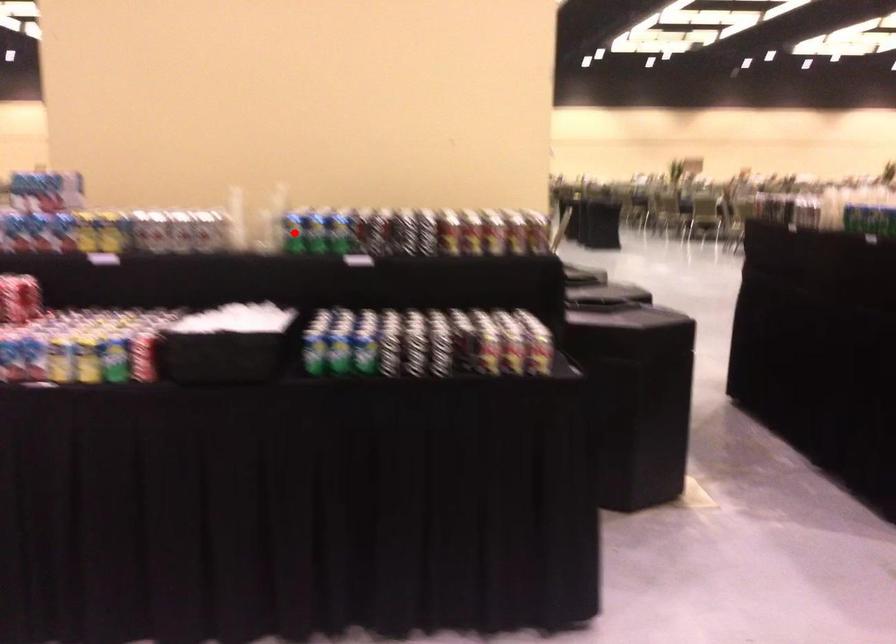
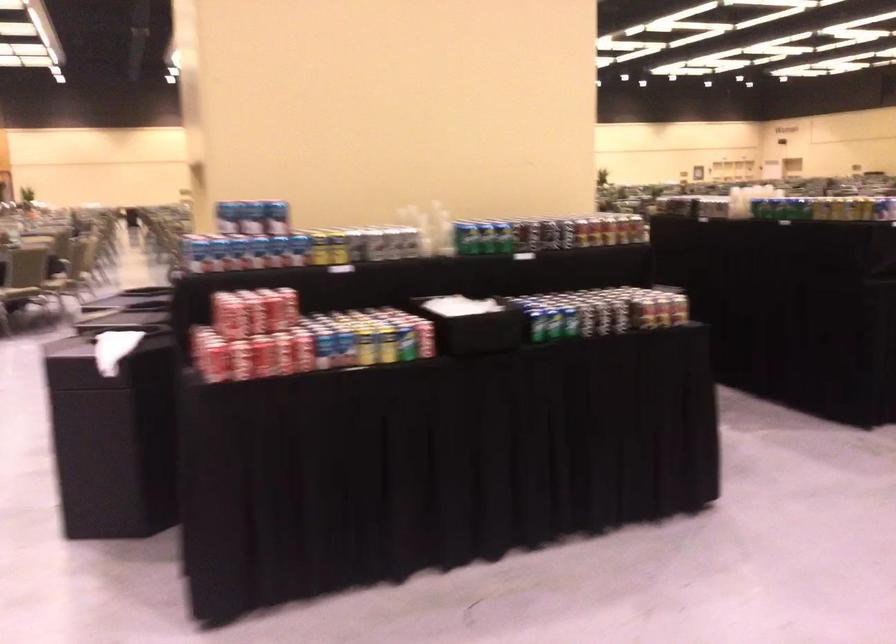
Question: A red point is marked in image1. In image2, is the corresponding 3D point closer to the camera or farther? Reply with the corresponding letter.

Choices:
 (A) The corresponding 3D point is closer.
 (B) The corresponding 3D point is farther.

Answer: (B)